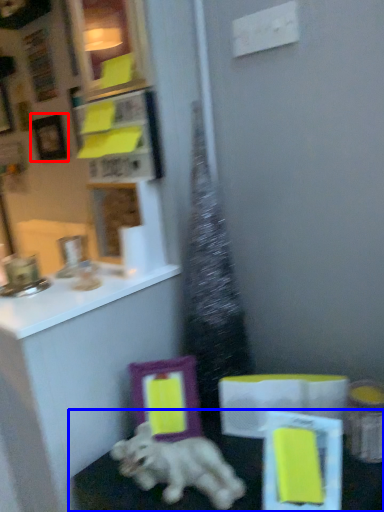
Question: Among these objects, which one is nearest to the camera, picture frame (highlighted by a red box) or table (highlighted by a blue box)?

Choices:
 (A) picture frame
 (B) table

Answer: (B)